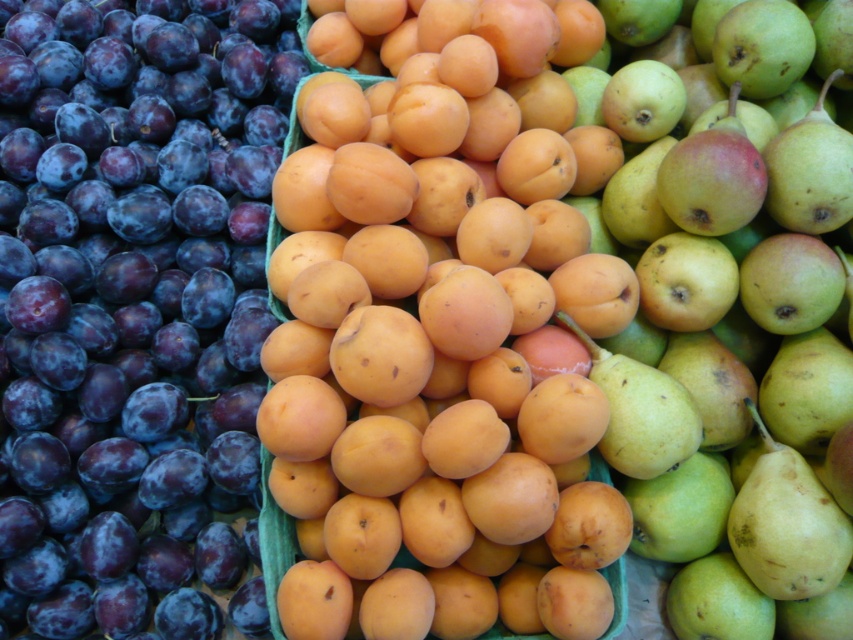
Who is lower down, orange matte apricot at center or shiny dark purple plum at left?

Positioned lower is orange matte apricot at center.

Is orange matte apricot at center positioned behind shiny dark purple plum at left?

That is False.

Locate an element on the screen. orange matte apricot at center is located at coordinates (439, 352).

Which is more to the left, shiny dark purple plum at left or green matte pear at center?

shiny dark purple plum at left is more to the left.

Who is positioned more to the right, shiny dark purple plum at left or green matte pear at center?

Positioned to the right is green matte pear at center.

Describe the element at coordinates (131, 307) in the screenshot. I see `shiny dark purple plum at left` at that location.

Find the location of a particular element. shiny dark purple plum at left is located at coordinates pyautogui.click(x=131, y=307).

Between orange matte apricot at center and green matte pear at center, which one is positioned higher?

Positioned higher is orange matte apricot at center.

The height and width of the screenshot is (640, 853). In order to click on orange matte apricot at center in this screenshot , I will do `click(439, 352)`.